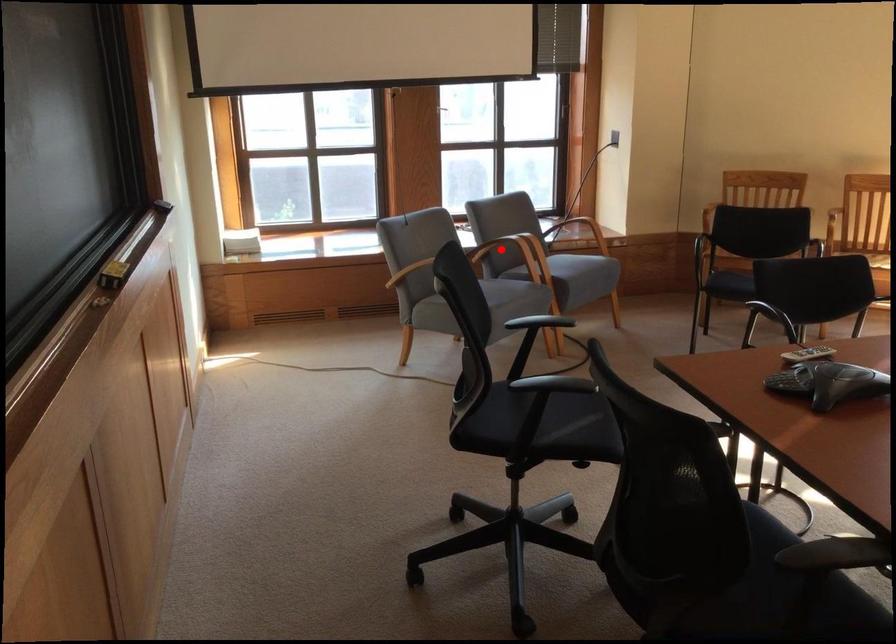
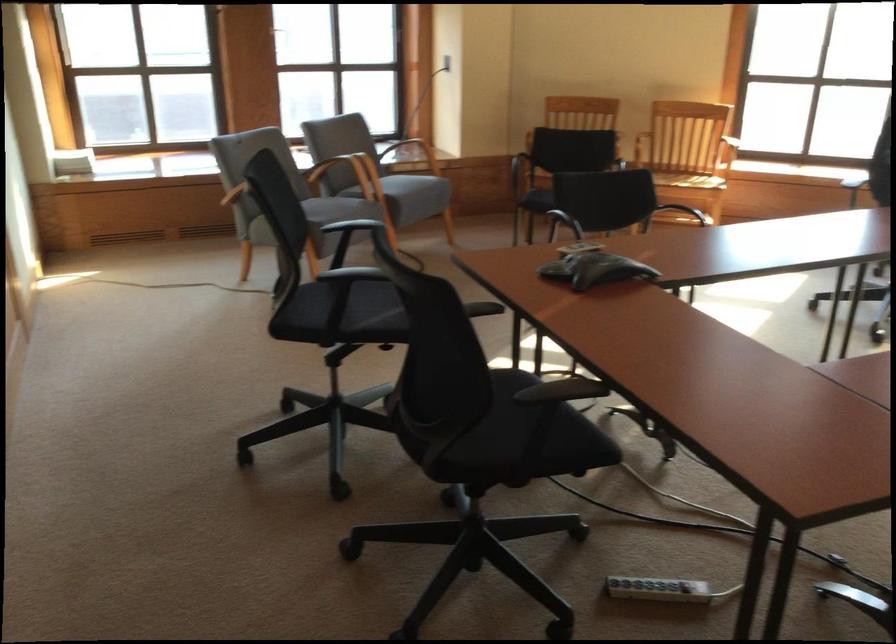
In the second image, find the point that corresponds to the highlighted location in the first image.

(342, 172)